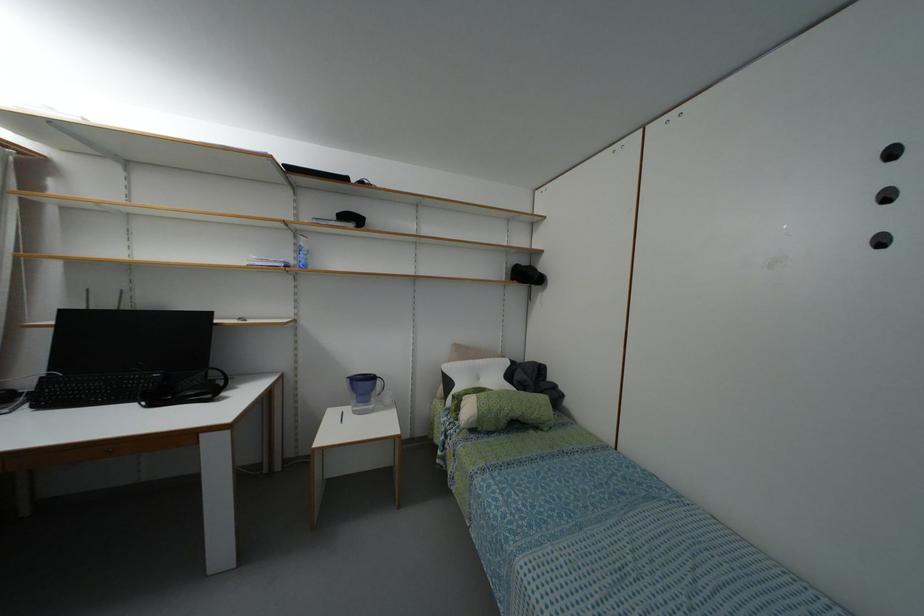
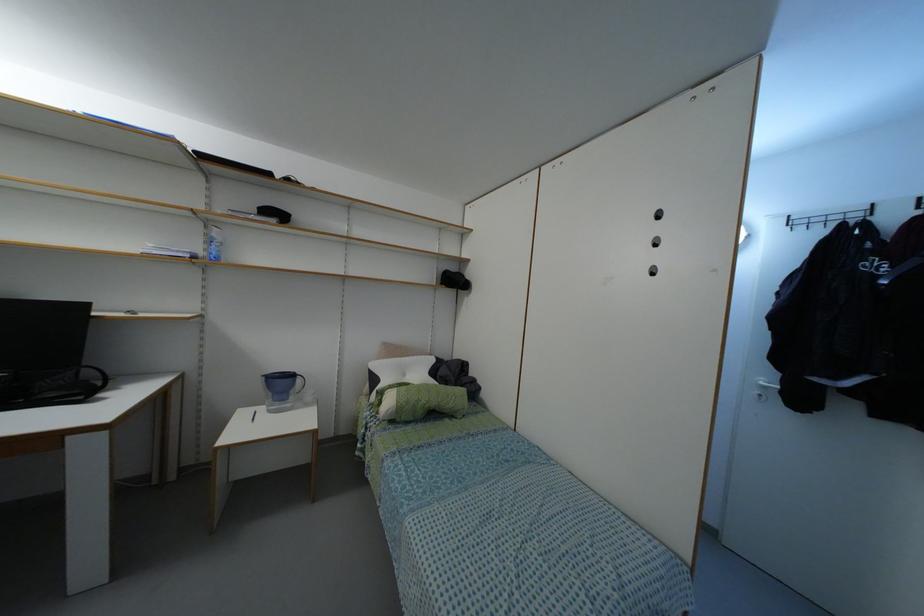
Question: The camera is either moving clockwise (left) or counter-clockwise (right) around the object. The first image is from the beginning of the video and the second image is from the end. Is the camera moving left or right when shooting the video?

Choices:
 (A) Left
 (B) Right

Answer: (A)